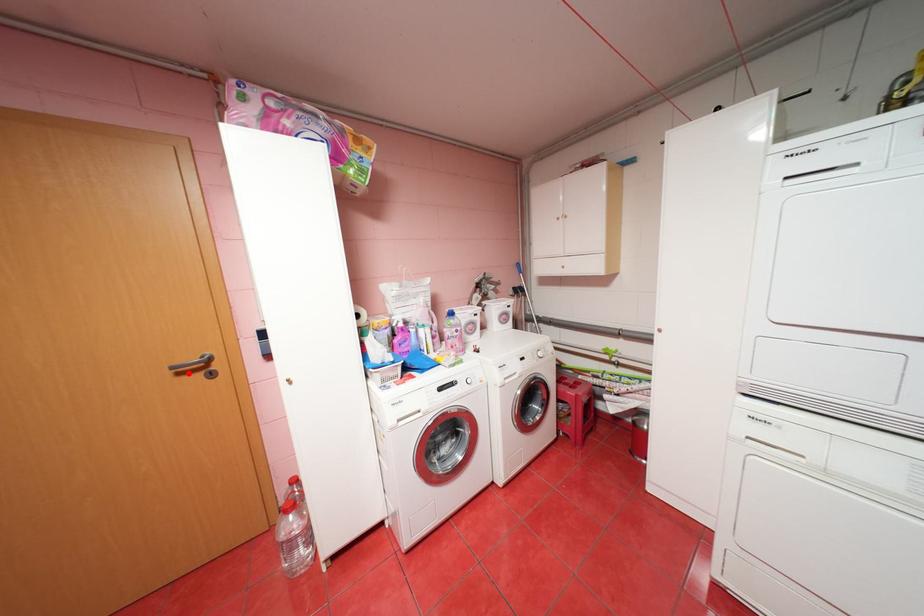
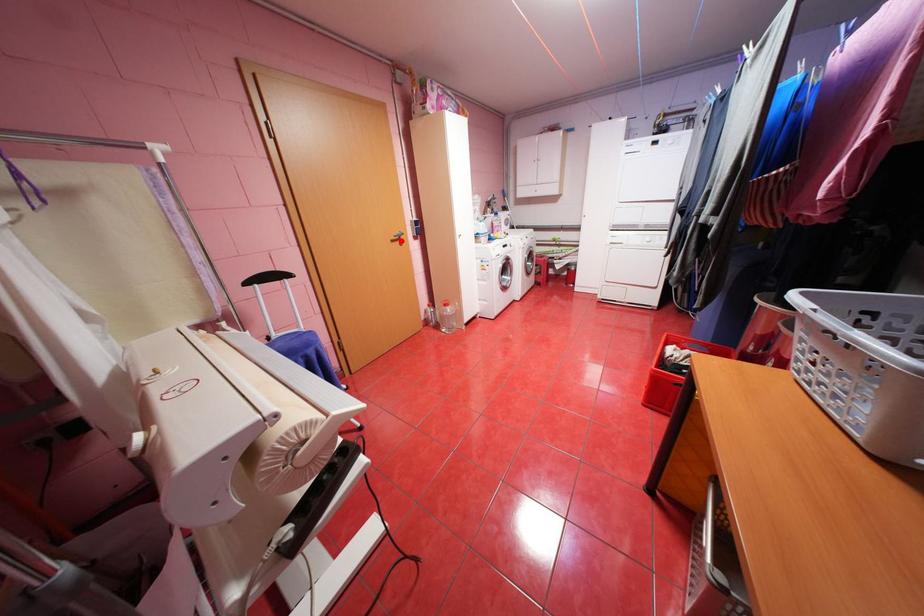
I am providing you with two images of the same scene from different viewpoints. A red point is marked on the first image and another point is marked on the second image. Does the point marked in image1 correspond to the same location as the one in image2?

Yes